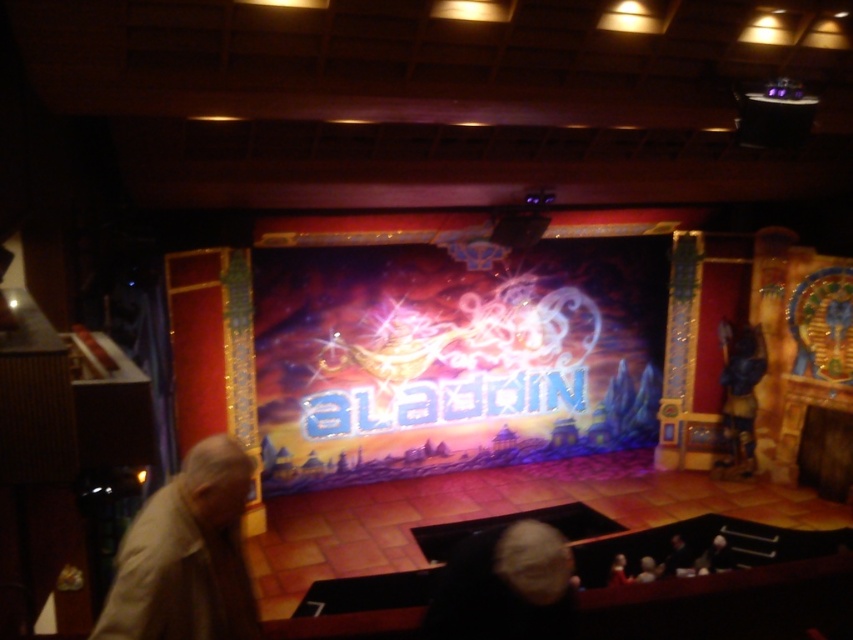
You are an audience member sitting in the front row of the stage. You notice two performers on stage. One has light beige hair at lower center and the other has dark hair at center. Which performer has a thinner hair style?

The light beige hair at lower center is thinner than dark hair at center, so the performer with light beige hair at lower center has a thinner hair style.

You are an actor on stage and need to move from the light beige fabric at lower left to the light beige hair at lower center. Which direction should you move?

The light beige fabric at lower left is to the left of light beige hair at lower center, so you should move to the right to reach the light beige hair at lower center.